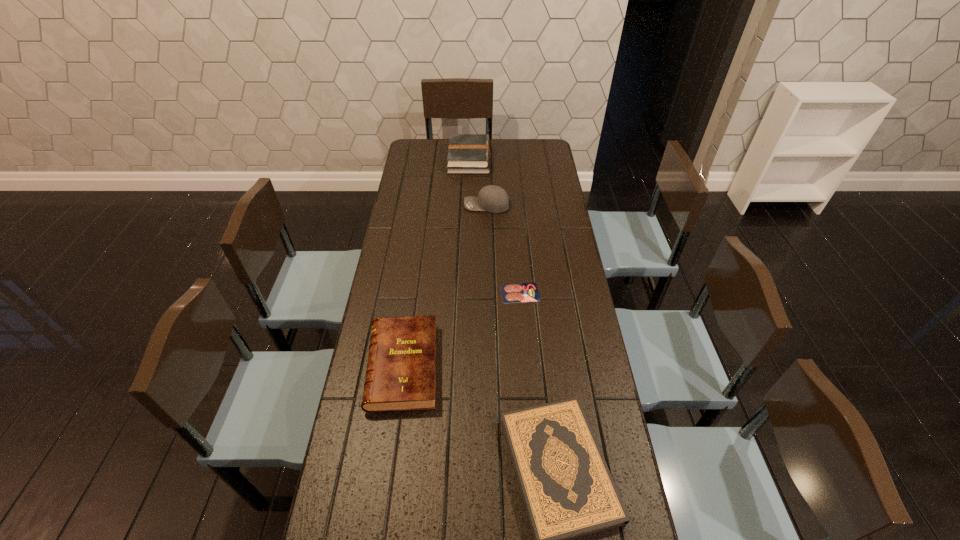
Find the location of a particular element. vacant space located on the front of the second tallest hardback book is located at coordinates click(393, 435).

This screenshot has height=540, width=960. Identify the location of free space located 0.080m on the right of the shortest object. (562, 293).

Find the location of a particular element. The image size is (960, 540). object that is at the far edge is located at coordinates (467, 153).

Where is `object located at the left edge`? The width and height of the screenshot is (960, 540). object located at the left edge is located at coordinates (401, 372).

Locate an element on the screen. object present at the right edge is located at coordinates (522, 292).

The height and width of the screenshot is (540, 960). I want to click on free space at the left edge, so click(406, 264).

Image resolution: width=960 pixels, height=540 pixels. What are the coordinates of `free spot at the right edge of the desktop` in the screenshot? It's located at (542, 184).

Identify the location of vacant area that lies between the baseball cap and the shortest object. The height and width of the screenshot is (540, 960). (503, 249).

Image resolution: width=960 pixels, height=540 pixels. Find the location of `blank region between the third nearest object and the second tallest hardback book`. blank region between the third nearest object and the second tallest hardback book is located at coordinates (461, 329).

In order to click on free space between the farthest object and the second shortest hardback book in this screenshot , I will do `click(436, 263)`.